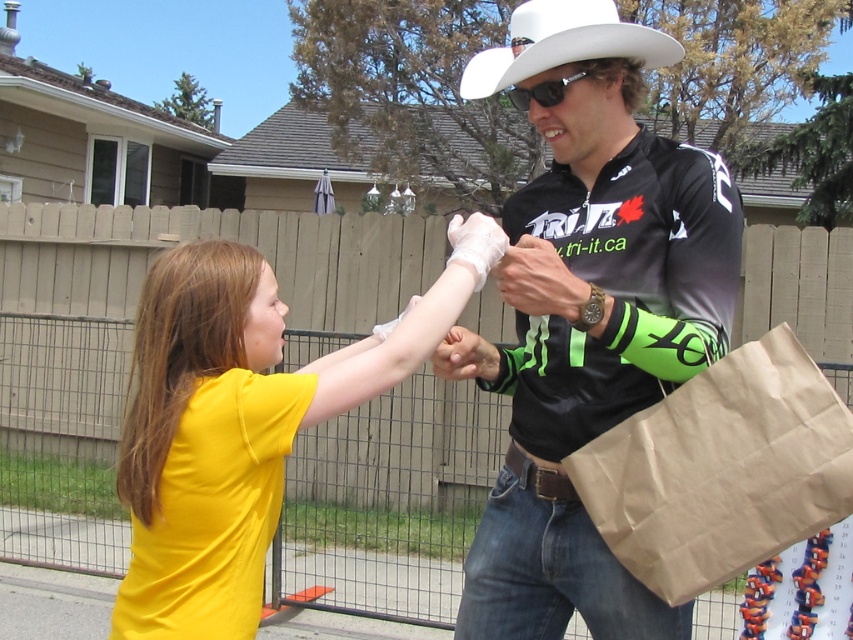
You are a photographer standing at the center of the scene. You want to take a photo that includes both the brown paper bag at right and the white felt cowboy hat at upper center. What is the minimum distance you need to move forward to ensure both objects are in frame?

The brown paper bag at right is 35.58 inches away from the white felt cowboy hat at upper center. To include both in the frame, you need to move forward until you are within 35.58 inches of the closer object, which would be the white felt cowboy hat at upper center since it is at upper center and the bag is at the right.

You are a photographer trying to capture a candid shot of the two people in the scene. You notice two points marked in the image. One is at coordinates point (216, 291) and the other is at point (624, 561). Which point is closer to your camera lens?

Point (216, 291) is closer to the camera than point (624, 561).